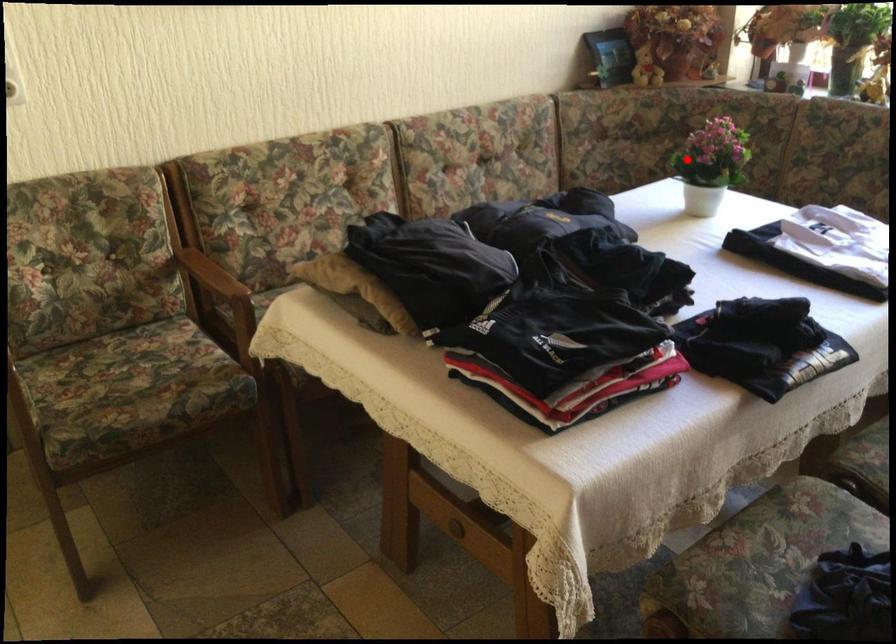
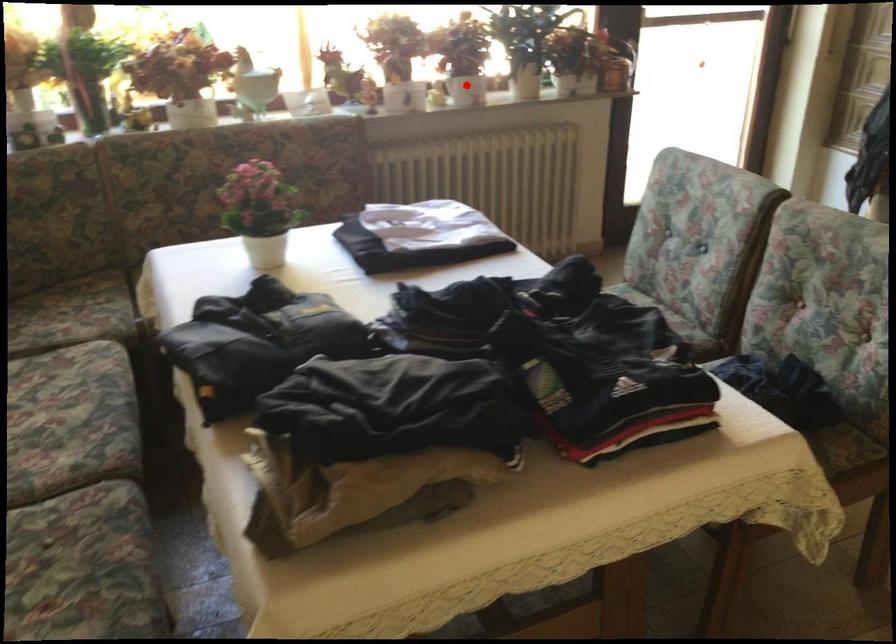
I am providing you with two images of the same scene from different viewpoints. A red point is marked on the first image and another point is marked on the second image. Are the points marked in image1 and image2 representing the same 3D position?

No